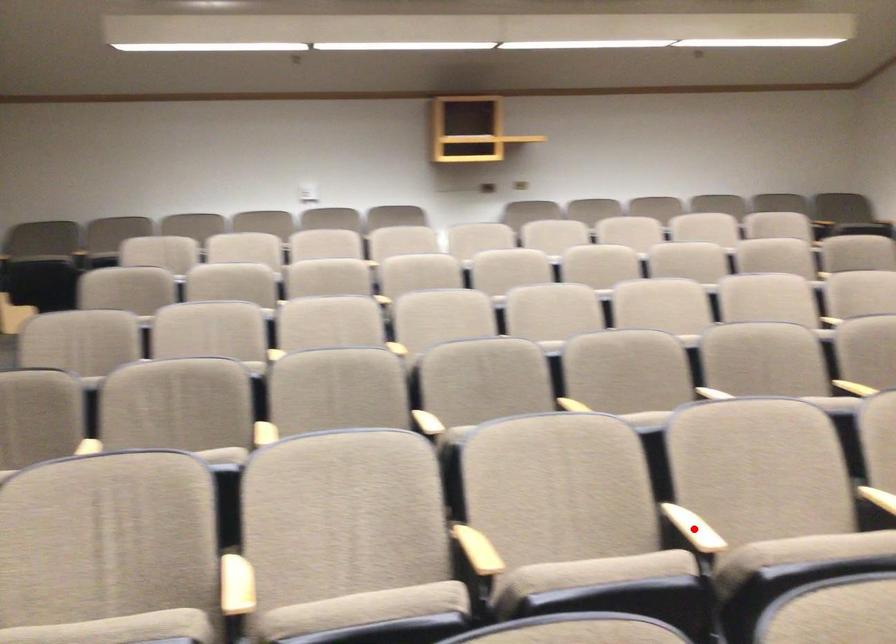
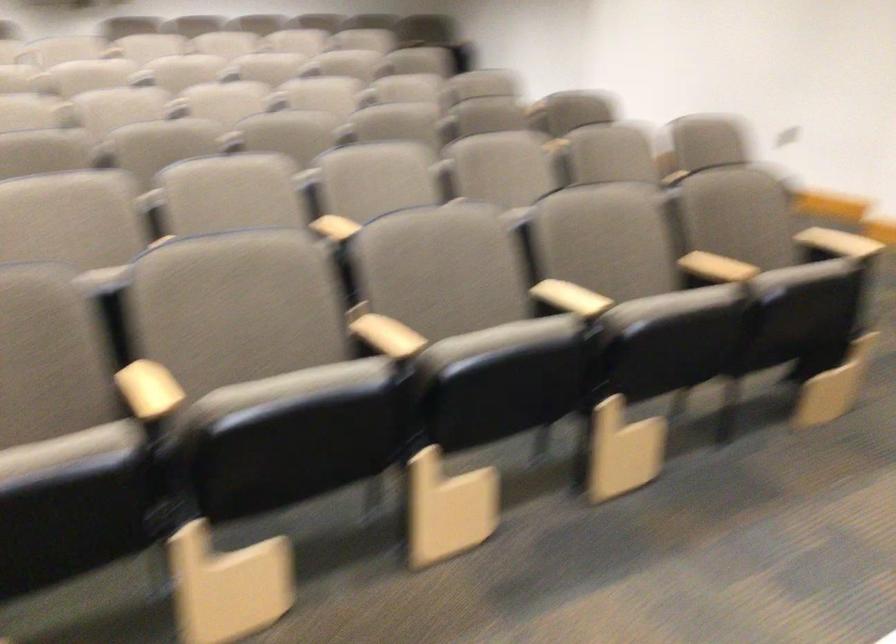
Question: I am providing you with two images of the same scene from different viewpoints. A red point is marked on the first image. Can you still see the location of the red point in image 2?

Choices:
 (A) Yes
 (B) No

Answer: (B)